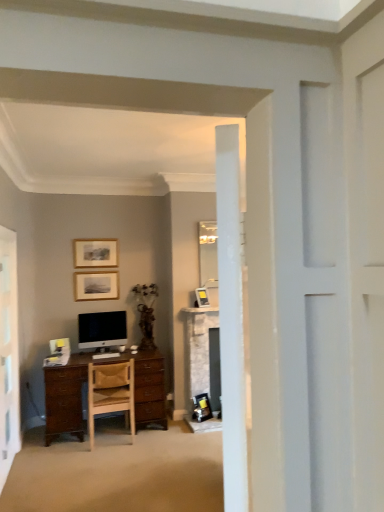
Question: From the image's perspective, is satin black monitor at center above or below matte gold picture frame at upper center, which ranks as the second picture frame in bottom-to-top order?

Choices:
 (A) above
 (B) below

Answer: (B)

Question: Would you say satin black monitor at center is inside or outside matte gold picture frame at upper center, which ranks as the second picture frame in bottom-to-top order?

Choices:
 (A) outside
 (B) inside

Answer: (A)

Question: Which object is positioned farthest from the wooden picture frame at upper center, the 3th picture frame from the bottom?

Choices:
 (A) satin black monitor at center
 (B) matte gold picture frame at upper center, acting as the second picture frame starting from the right
 (C) matte silver picture frame at center, which is the third picture frame in top-to-bottom order
 (D) white glossy screen door at left
 (E) wooden chair at center

Answer: (E)

Question: Which is farther from the matte gold picture frame at upper center, which appears as the 2th picture frame when viewed from the top?

Choices:
 (A) white glossy screen door at left
 (B) wooden picture frame at upper center, the first picture frame when ordered from left to right
 (C) wooden chair at center
 (D) matte silver picture frame at center, arranged as the third picture frame when viewed from the left
 (E) satin black monitor at center

Answer: (A)